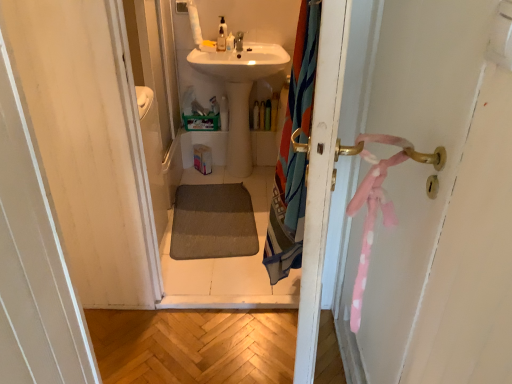
Question: Is matte white faucet at upper center surrounded by translucent plastic bottle at center, acting as the fourth toiletry starting from the top?

Choices:
 (A) yes
 (B) no

Answer: (B)

Question: Considering the relative sizes of translucent plastic bottle at center, the second toiletry positioned from the right, and matte white faucet at upper center in the image provided, is translucent plastic bottle at center, the second toiletry positioned from the right, smaller than matte white faucet at upper center?

Choices:
 (A) yes
 (B) no

Answer: (B)

Question: Can we say translucent plastic bottle at center, which ranks as the third toiletry in front-to-back order, lies outside matte white faucet at upper center?

Choices:
 (A) yes
 (B) no

Answer: (A)

Question: From the image's perspective, is translucent plastic bottle at center, positioned as the first toiletry in bottom-to-top order, beneath matte white faucet at upper center?

Choices:
 (A) yes
 (B) no

Answer: (A)

Question: From a real-world perspective, is translucent plastic bottle at center, positioned as the first toiletry in bottom-to-top order, positioned under matte white faucet at upper center based on gravity?

Choices:
 (A) no
 (B) yes

Answer: (B)

Question: Could you tell me if translucent plastic bottle at center, which is the third toiletry from left to right, is turned towards matte white faucet at upper center?

Choices:
 (A) no
 (B) yes

Answer: (A)

Question: Considering the relative sizes of translucent plastic soap dispenser at upper center, which is the first toiletry from left to right, and white glossy sink at center in the image provided, is translucent plastic soap dispenser at upper center, which is the first toiletry from left to right, shorter than white glossy sink at center?

Choices:
 (A) yes
 (B) no

Answer: (A)

Question: Is translucent plastic soap dispenser at upper center, which is counted as the 1th toiletry, starting from the front, not near white glossy sink at center?

Choices:
 (A) yes
 (B) no

Answer: (B)

Question: Is translucent plastic soap dispenser at upper center, which is counted as the 1th toiletry, starting from the front, located outside white glossy sink at center?

Choices:
 (A) yes
 (B) no

Answer: (A)

Question: Can you confirm if translucent plastic soap dispenser at upper center, which is counted as the 1th toiletry, starting from the front, is bigger than white glossy sink at center?

Choices:
 (A) yes
 (B) no

Answer: (B)

Question: Does translucent plastic soap dispenser at upper center, which is the 2th toiletry from top to bottom, turn towards white glossy sink at center?

Choices:
 (A) yes
 (B) no

Answer: (B)

Question: From the image's perspective, is translucent plastic soap dispenser at upper center, the fourth toiletry from the right, on top of white glossy sink at center?

Choices:
 (A) yes
 (B) no

Answer: (A)

Question: Is white glossy sink at center a part of translucent plastic soap dispenser at upper center, which is counted as the fourth toiletry, starting from the bottom?

Choices:
 (A) no
 (B) yes

Answer: (A)